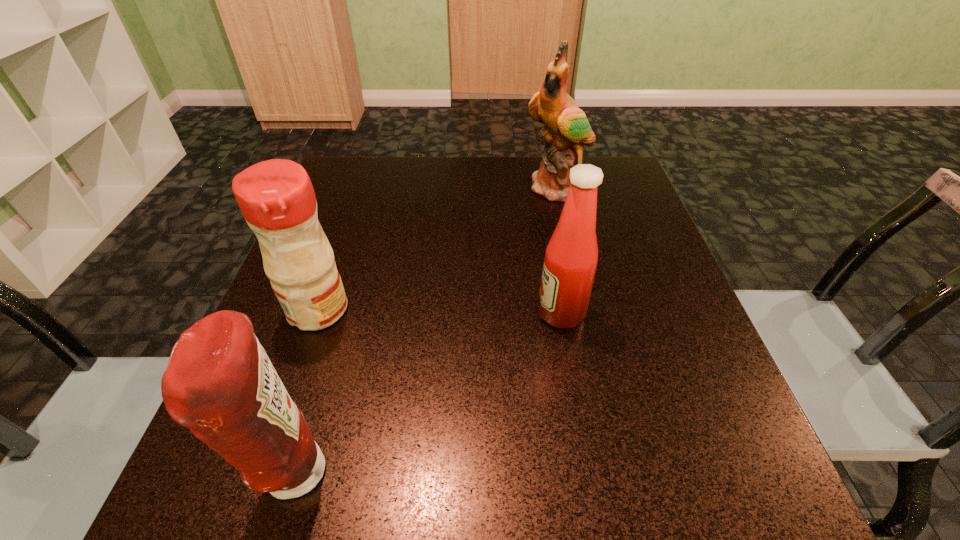
Image resolution: width=960 pixels, height=540 pixels. In order to click on the farthest object in this screenshot , I will do `click(567, 128)`.

The height and width of the screenshot is (540, 960). Identify the location of parrot. coord(567,128).

The height and width of the screenshot is (540, 960). Identify the location of the rightmost condiment. tap(571, 257).

The image size is (960, 540). I want to click on the nearest object, so click(x=220, y=383).

You are a GUI agent. You are given a task and a screenshot of the screen. Output one action in this format:
    pyautogui.click(x=<x>, y=<y>)
    Task: Click on the free location located 0.130m on the front-facing side of the parrot
    This screenshot has height=540, width=960.
    Given the screenshot: What is the action you would take?
    pyautogui.click(x=568, y=239)

The width and height of the screenshot is (960, 540). I want to click on free space located 0.390m on the front-facing side of the rightmost condiment, so click(x=324, y=313).

The width and height of the screenshot is (960, 540). In order to click on vacant area situated 0.160m on the front-facing side of the rightmost condiment in this screenshot , I will do `click(450, 313)`.

Locate an element on the screen. This screenshot has width=960, height=540. vacant space located 0.240m on the front-facing side of the rightmost condiment is located at coordinates (406, 313).

What are the coordinates of `free location located on the right of the nearest object` in the screenshot? It's located at (576, 473).

In order to click on object that is positioned at the far edge in this screenshot , I will do click(x=567, y=128).